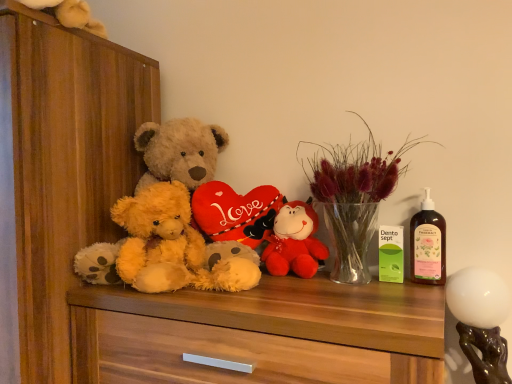
Question: Does velvet plush bear at center, the first toy in the top-to-bottom sequence, have a greater width compared to fluffy yellow teddy bear at center?

Choices:
 (A) no
 (B) yes

Answer: (A)

Question: Is fluffy yellow teddy bear at center completely or partially inside velvet plush bear at center, the 2th toy when ordered from bottom to top?

Choices:
 (A) no
 (B) yes

Answer: (A)

Question: Can you confirm if velvet plush bear at center, which is the 1th toy from back to front, is thinner than fluffy yellow teddy bear at center?

Choices:
 (A) no
 (B) yes

Answer: (B)

Question: Are velvet plush bear at center, acting as the 2th toy starting from the front, and fluffy yellow teddy bear at center located far from each other?

Choices:
 (A) yes
 (B) no

Answer: (B)

Question: Considering the relative positions of velvet plush bear at center, which is the 1th toy from back to front, and fluffy yellow teddy bear at center in the image provided, is velvet plush bear at center, which is the 1th toy from back to front, in front of fluffy yellow teddy bear at center?

Choices:
 (A) no
 (B) yes

Answer: (A)

Question: In the image, is wooden dresser at left on the left side or the right side of translucent plastic bottle at right?

Choices:
 (A) left
 (B) right

Answer: (A)

Question: Looking at the image, does wooden dresser at left seem bigger or smaller compared to translucent plastic bottle at right?

Choices:
 (A) big
 (B) small

Answer: (A)

Question: Considering their positions, is wooden dresser at left located in front of or behind translucent plastic bottle at right?

Choices:
 (A) front
 (B) behind

Answer: (A)

Question: Considering the positions of point (61, 31) and point (434, 236), is point (61, 31) closer or farther from the camera than point (434, 236)?

Choices:
 (A) farther
 (B) closer

Answer: (A)

Question: Is point (416, 256) positioned closer to the camera than point (142, 228)?

Choices:
 (A) farther
 (B) closer

Answer: (B)

Question: Is translucent plastic bottle at right situated inside soft brown plush at center or outside?

Choices:
 (A) inside
 (B) outside

Answer: (B)

Question: Relative to soft brown plush at center, is translucent plastic bottle at right in front or behind?

Choices:
 (A) behind
 (B) front

Answer: (B)

Question: Is translucent plastic bottle at right to the left or to the right of soft brown plush at center in the image?

Choices:
 (A) left
 (B) right

Answer: (B)

Question: From their relative heights in the image, would you say fluffy yellow teddy bear at center is taller or shorter than velvet plush bear at center, the 1th toy viewed from the left?

Choices:
 (A) short
 (B) tall

Answer: (B)

Question: In the image, is fluffy yellow teddy bear at center on the left side or the right side of velvet plush bear at center, acting as the 2th toy starting from the front?

Choices:
 (A) right
 (B) left

Answer: (B)